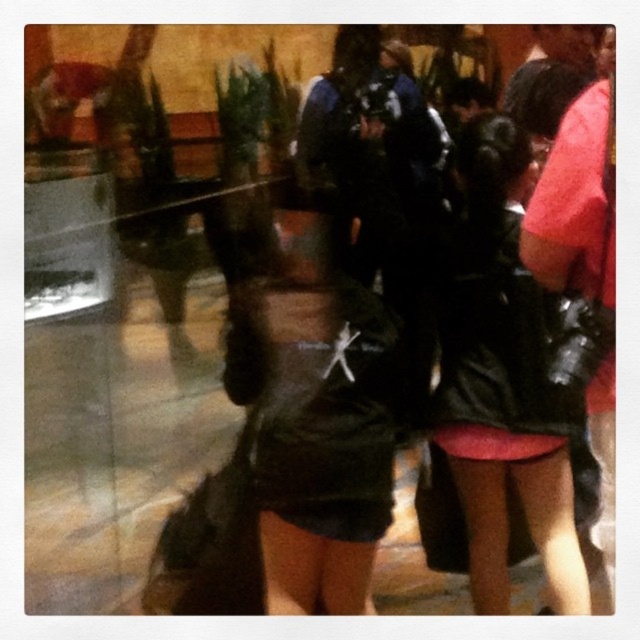
Is point (324, 426) behind point (564, 424)?

No, (324, 426) is closer to viewer.

Who is positioned more to the left, black leather jacket at center or black leather dress at right?

From the viewer's perspective, black leather jacket at center appears more on the left side.

Describe the element at coordinates (321, 422) in the screenshot. I see `black leather jacket at center` at that location.

Where is `black leather jacket at center`? This screenshot has height=640, width=640. black leather jacket at center is located at coordinates coord(321,422).

Is point (540, 448) closer to viewer compared to point (467, 456)?

That is True.

Find the location of a particular element. The image size is (640, 640). leather jacket at center is located at coordinates (504, 381).

Is black leather jacket at center to the right of leather jacket at center from the viewer's perspective?

Incorrect, black leather jacket at center is not on the right side of leather jacket at center.

You are a GUI agent. You are given a task and a screenshot of the screen. Output one action in this format:
    pyautogui.click(x=<x>, y=<y>)
    Task: Click on the black leather jacket at center
    This screenshot has width=640, height=640.
    Given the screenshot: What is the action you would take?
    pyautogui.click(x=321, y=422)